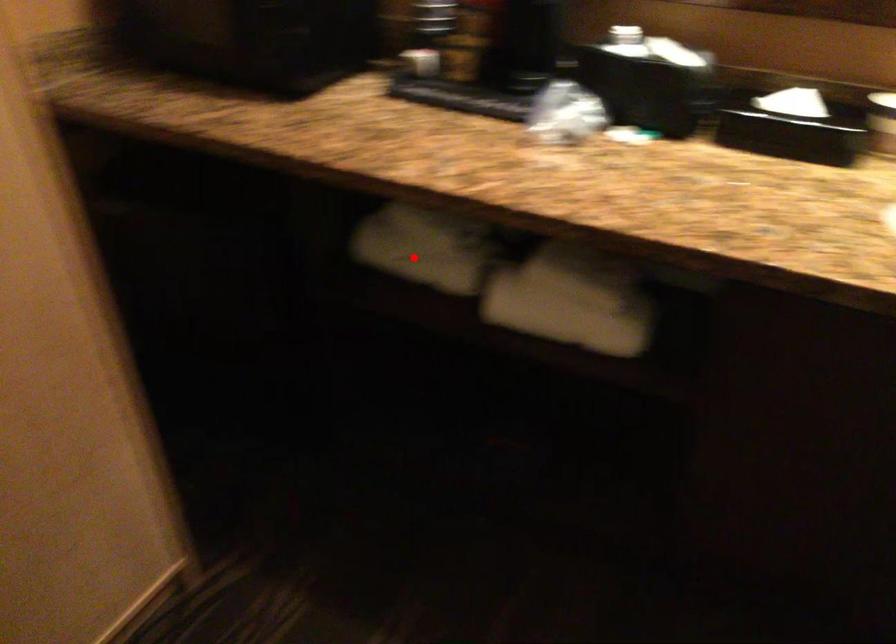
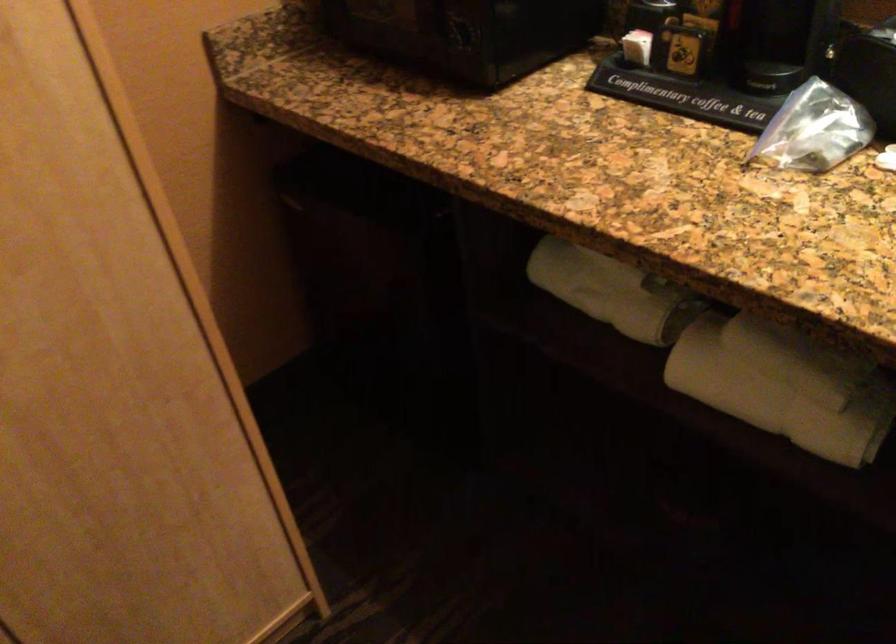
Question: I am providing you with two images of the same scene from different viewpoints. A red point is shown in image1. For the corresponding object point in image2, is it positioned nearer or farther from the camera?

Choices:
 (A) Nearer
 (B) Farther

Answer: (A)